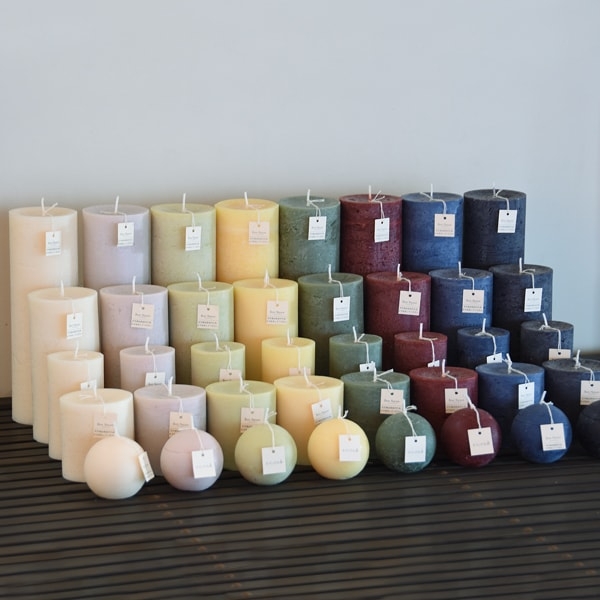
The image size is (600, 600). Find the location of `candles in second row from back`. candles in second row from back is located at coordinates (56, 320), (123, 317), (185, 316), (258, 315), (321, 304), (382, 300), (449, 297), (512, 296).